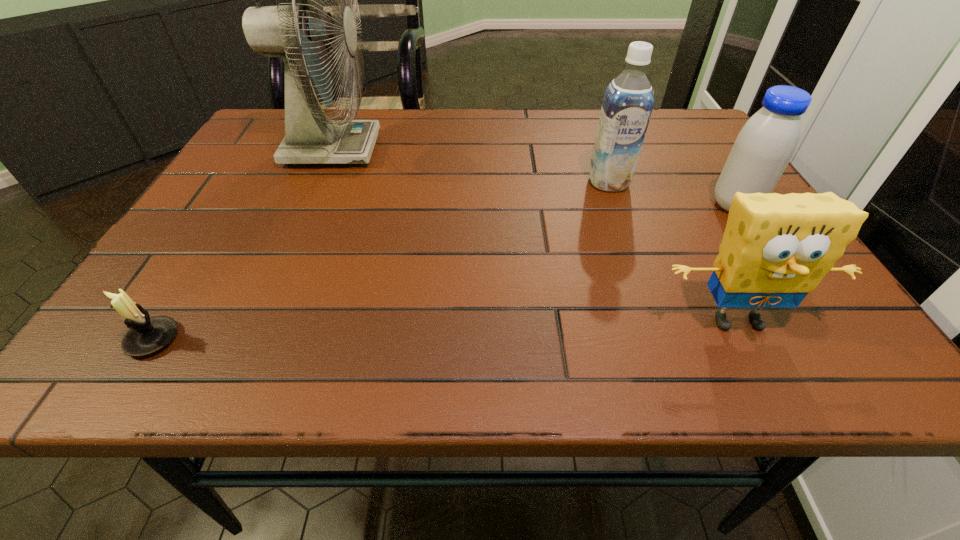
You are a GUI agent. You are given a task and a screenshot of the screen. Output one action in this format:
    pyautogui.click(x=<x>, y=<y>)
    Task: Click on the object that is at the near left corner
    The width and height of the screenshot is (960, 540).
    Given the screenshot: What is the action you would take?
    pyautogui.click(x=147, y=335)

The height and width of the screenshot is (540, 960). Identify the location of object located at the near right corner. (776, 249).

The width and height of the screenshot is (960, 540). What are the coordinates of `free location at the far edge of the desktop` in the screenshot? It's located at (530, 123).

Locate an element on the screen. The height and width of the screenshot is (540, 960). vacant space at the near edge of the desktop is located at coordinates (512, 347).

In the image, there is a desktop. Where is `vacant space at the left edge`? vacant space at the left edge is located at coordinates (274, 196).

Locate an element on the screen. This screenshot has height=540, width=960. free region at the far right corner of the desktop is located at coordinates (678, 120).

Identify the location of vacant area at the near right corner. This screenshot has width=960, height=540. (765, 356).

Find the location of a particular element. This screenshot has height=540, width=960. free point between the fourth shortest object and the sponge is located at coordinates (673, 252).

You are a GUI agent. You are given a task and a screenshot of the screen. Output one action in this format:
    pyautogui.click(x=<x>, y=<y>)
    Task: Click on the vacant region between the sponge and the candle holder
    This screenshot has height=540, width=960.
    Given the screenshot: What is the action you would take?
    pyautogui.click(x=445, y=330)

The image size is (960, 540). In order to click on vacant area that lies between the fan and the taller soya milk in this screenshot , I will do `click(470, 166)`.